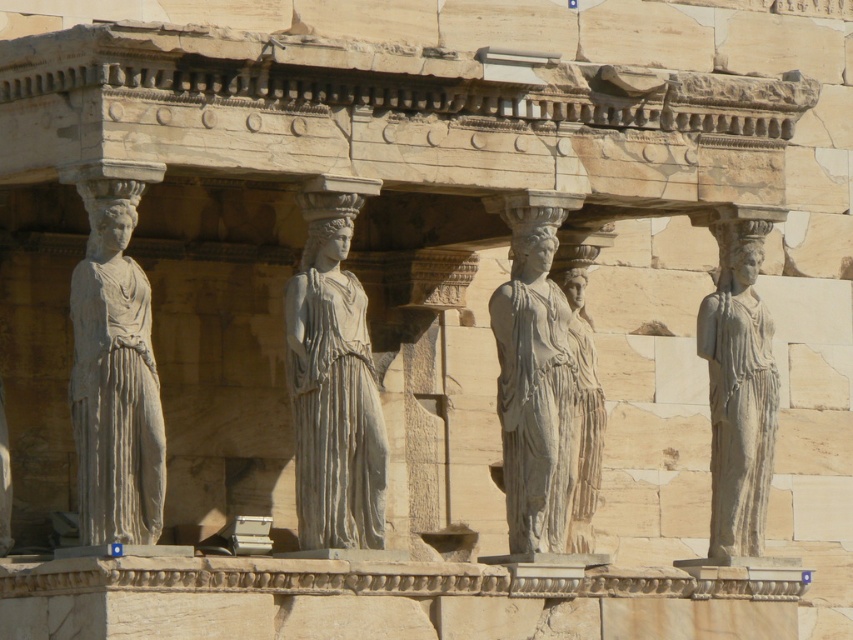
Is white marble statue at center below gray stone statue at center?

Yes, white marble statue at center is below gray stone statue at center.

Between point (294, 298) and point (550, 308), which one is positioned behind?

Positioned behind is point (550, 308).

Is point (310, 212) positioned after point (546, 256)?

No, it is not.

In order to click on white marble statue at center in this screenshot , I will do `click(334, 387)`.

Who is more distant from viewer, (375, 378) or (741, 532)?

Point (741, 532)

Which is more to the left, white marble statue at center or gray stone statue at right?

white marble statue at center is more to the left.

What do you see at coordinates (334, 387) in the screenshot?
I see `white marble statue at center` at bounding box center [334, 387].

You are a GUI agent. You are given a task and a screenshot of the screen. Output one action in this format:
    pyautogui.click(x=<x>, y=<y>)
    Task: Click on the white marble statue at center
    The width and height of the screenshot is (853, 640).
    Given the screenshot: What is the action you would take?
    pyautogui.click(x=334, y=387)

Is point (86, 445) positioned after point (517, 540)?

No, (86, 445) is in front of (517, 540).

Where is `light gray stone caryatid at left`? Image resolution: width=853 pixels, height=640 pixels. light gray stone caryatid at left is located at coordinates (114, 378).